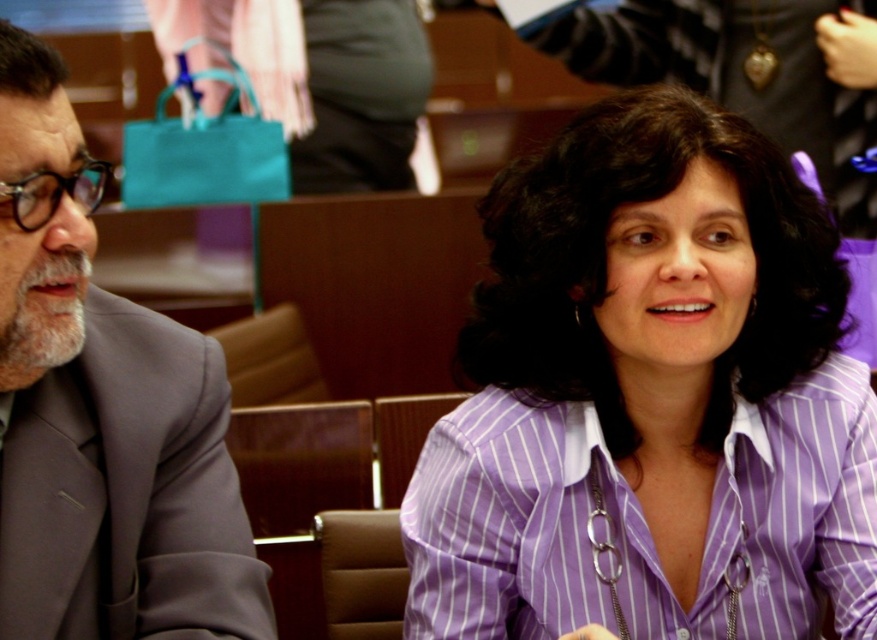
Who is lower down, purple striped shirt at center or matte gray suit at left?

purple striped shirt at center is lower down.

Can you confirm if purple striped shirt at center is shorter than matte gray suit at left?

No.

Between point (518, 333) and point (182, 337), which one is positioned in front?

Point (182, 337) is more forward.

I want to click on purple striped shirt at center, so click(650, 397).